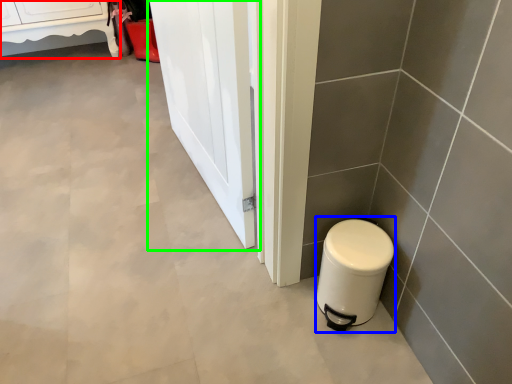
Question: Which object is the closest to the furniture (highlighted by a red box)? Choose among these: appliance (highlighted by a blue box) or screen door (highlighted by a green box).

Choices:
 (A) appliance
 (B) screen door

Answer: (B)